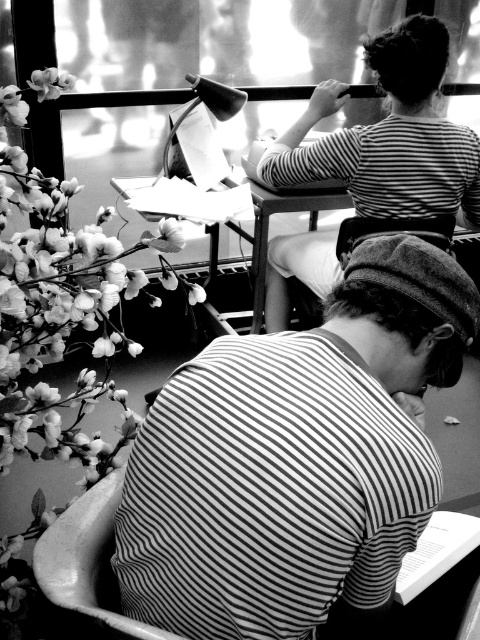
Question: Which point is farther to the camera?

Choices:
 (A) fluffy white flowers at left
 (B) smooth wooden table at center

Answer: (B)

Question: Which point is closer to the camera?

Choices:
 (A) fluffy white flowers at left
 (B) soft white petals at upper left
 (C) smooth wooden table at center
 (D) striped fabric shirt at lower center

Answer: (D)

Question: Does fluffy white flowers at left have a lesser width compared to soft white petals at upper left?

Choices:
 (A) yes
 (B) no

Answer: (B)

Question: Observing the image, what is the correct spatial positioning of fluffy white flowers at left in reference to striped shirt at upper center?

Choices:
 (A) left
 (B) right

Answer: (A)

Question: Which point is closer to the camera?

Choices:
 (A) striped fabric shirt at lower center
 (B) fluffy white flowers at left
 (C) soft white petals at upper left

Answer: (A)

Question: Does striped fabric shirt at lower center have a larger size compared to striped shirt at upper center?

Choices:
 (A) no
 (B) yes

Answer: (A)